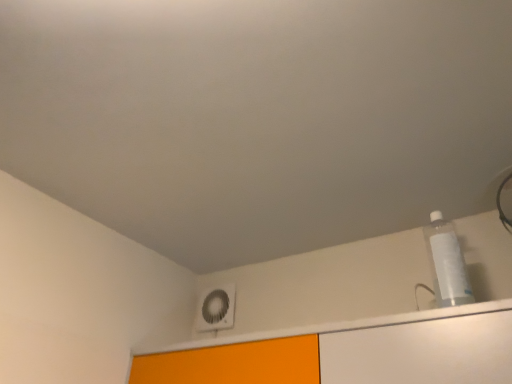
What do you see at coordinates (447, 263) in the screenshot?
I see `transparent plastic bottle at upper right` at bounding box center [447, 263].

Where is `transparent plastic bottle at upper right`? Image resolution: width=512 pixels, height=384 pixels. transparent plastic bottle at upper right is located at coordinates (447, 263).

The width and height of the screenshot is (512, 384). I want to click on transparent plastic bottle at upper right, so click(x=447, y=263).